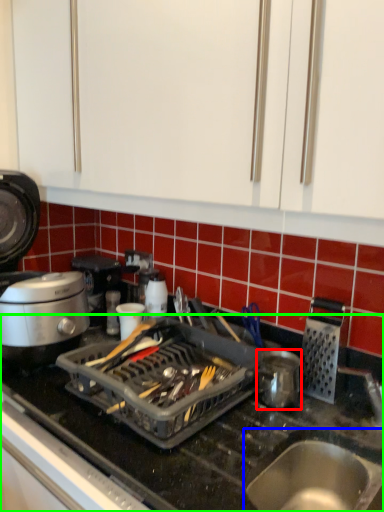
Question: Which object is the closest to the kitchen appliance (highlighted by a red box)? Choose among these: sink (highlighted by a blue box) or countertop (highlighted by a green box).

Choices:
 (A) sink
 (B) countertop

Answer: (A)